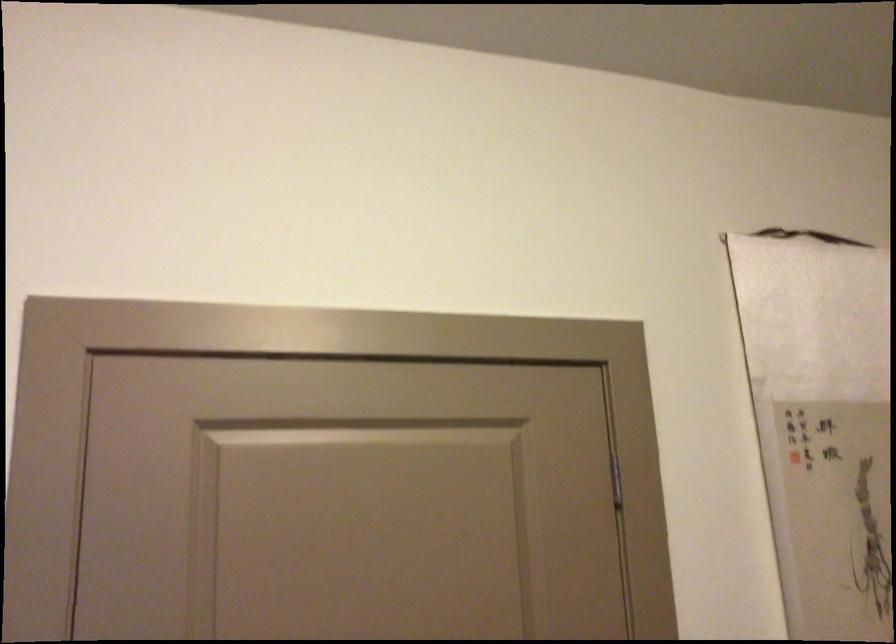
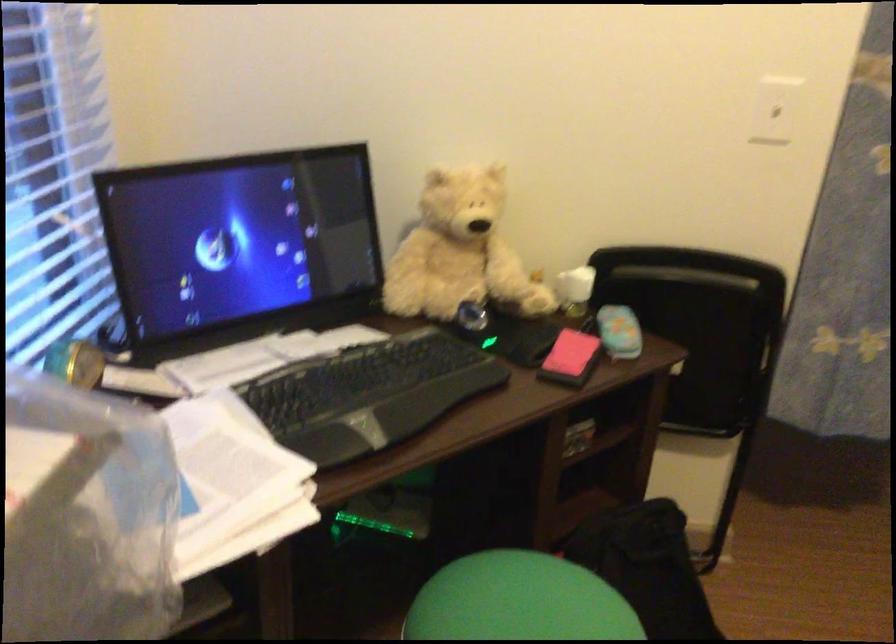
Based on the continuous images, in which direction is the camera rotating?

The camera's rotation is toward left-down.